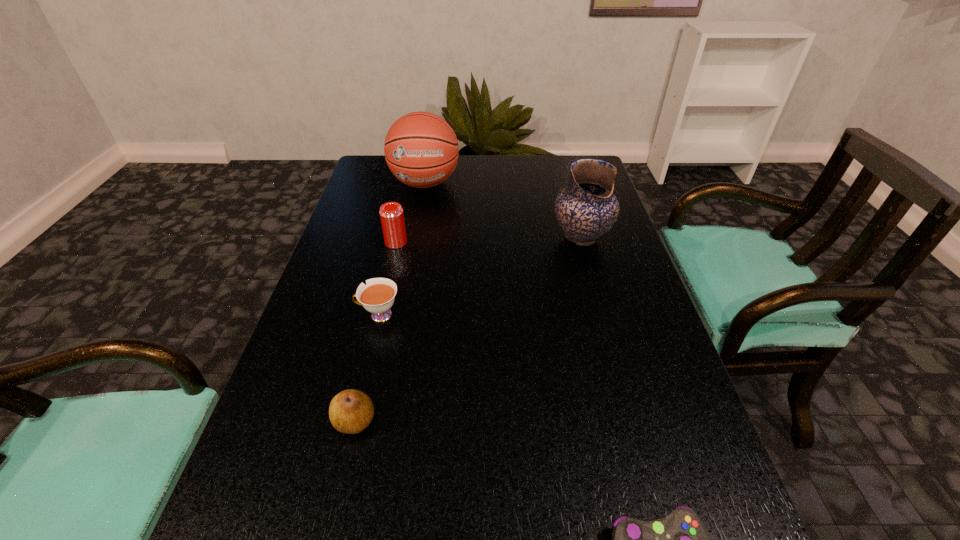
Locate an element on the screen. The width and height of the screenshot is (960, 540). blank space that satisfies the following two spatial constraints: 1. on the logo side of the basketball; 2. on the side of the fifth tallest object with the handle is located at coordinates (401, 315).

I want to click on free space that satisfies the following two spatial constraints: 1. on the front side of the pottery; 2. on the side of the fourth farthest object with the handle, so pyautogui.click(x=603, y=315).

Locate an element on the screen. free space that satisfies the following two spatial constraints: 1. on the logo side of the basketball; 2. on the side of the third nearest object with the handle is located at coordinates (401, 315).

Where is `vacant space that satisfies the following two spatial constraints: 1. on the back side of the second nearest object; 2. on the side of the fourth farthest object with the handle`? The width and height of the screenshot is (960, 540). vacant space that satisfies the following two spatial constraints: 1. on the back side of the second nearest object; 2. on the side of the fourth farthest object with the handle is located at coordinates (379, 315).

Identify the location of free region that satisfies the following two spatial constraints: 1. on the logo side of the pottery; 2. on the left side of the farthest object. (415, 237).

Identify the location of vacant space that satisfies the following two spatial constraints: 1. on the logo side of the farthest object; 2. on the side of the fifth tallest object with the handle. (401, 315).

At what (x,y) coordinates should I click in order to perform the action: click on free location that satisfies the following two spatial constraints: 1. on the front side of the pear; 2. on the right side of the beer can. Please return your answer as a coordinate pair (x, y). The width and height of the screenshot is (960, 540). Looking at the image, I should click on (354, 421).